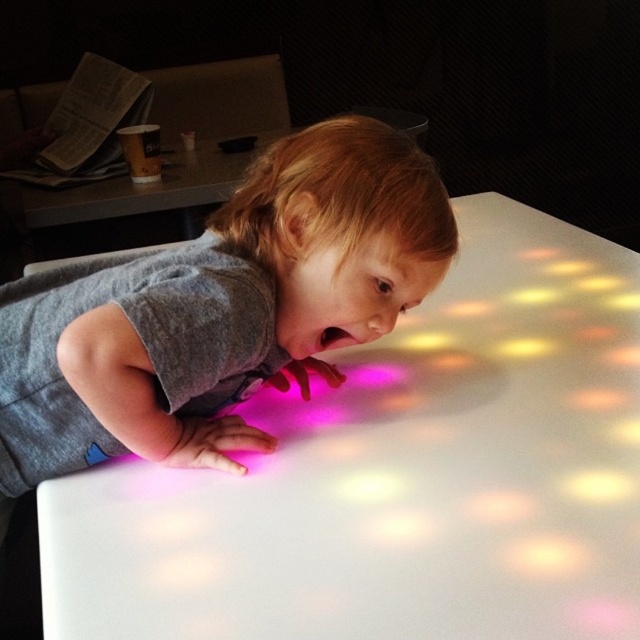
You are a photographer trying to capture the child interacting with the white glossy table at center and the gray matte shirt at center. Which object should you focus on first to ensure it appears sharp in the photo?

The white glossy table at center is in front of the gray matte shirt at center, so you should focus on the white glossy table at center first to ensure it appears sharp in the photo.

You are designing a layout for a childrens play area and need to ensure that the gray matte shirt at center can be placed on the white glossy table at center without overlapping. Based on their sizes, is this possible?

The white glossy table at center might be wider than gray matte shirt at center, so it is possible to place the gray matte shirt at center on the table without overlapping.

You are designing a safety protocol for a childrens play area. You need to ensure that the white glossy table at center and the gray matte shirt at center maintain a minimum distance of 25 centimeters to prevent accidental contact. Based on the image, is this requirement met?

The white glossy table at center is 20.53 centimeters away from the gray matte shirt at center, which is less than the required 25 centimeters. The requirement is not met.